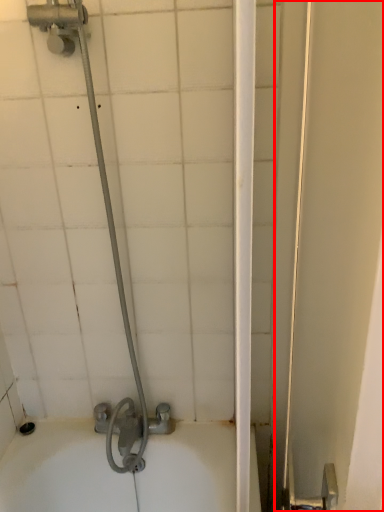
Question: Where is screen door (annotated by the red box) located in relation to shower in the image?

Choices:
 (A) left
 (B) right

Answer: (B)